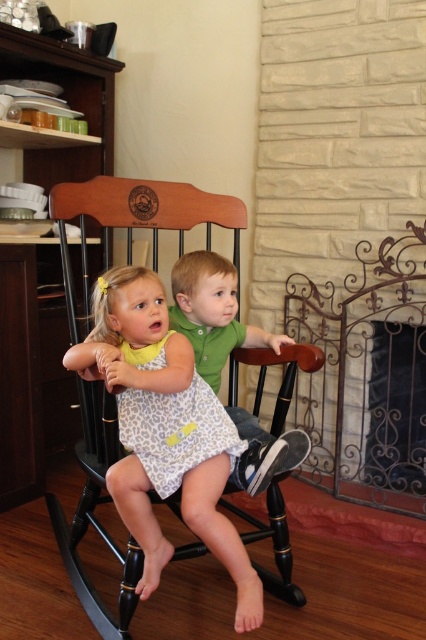
You are a photographer trying to capture a candid shot of the two children sitting on the wooden rocking chair. You notice two specific points marked in the scene at coordinates point [330,483] and point [253,582]. To ensure the shot is framed correctly, which point should you focus on first if you want to capture the foreground elements before the background?

Point [253,582] should be focused on first because it is in the foreground, while point [330,483] is behind it and thus part of the background.

You are a delivery robot with a package that is 30 inches long. You need to place it between the iron wrought at right and the green matte shirt at center. Is there enough space?

The distance between the iron wrought at right and the green matte shirt at center is 28.50 inches, which is shorter than the package length of 30 inches. Therefore, there is not enough space to place the package between them.